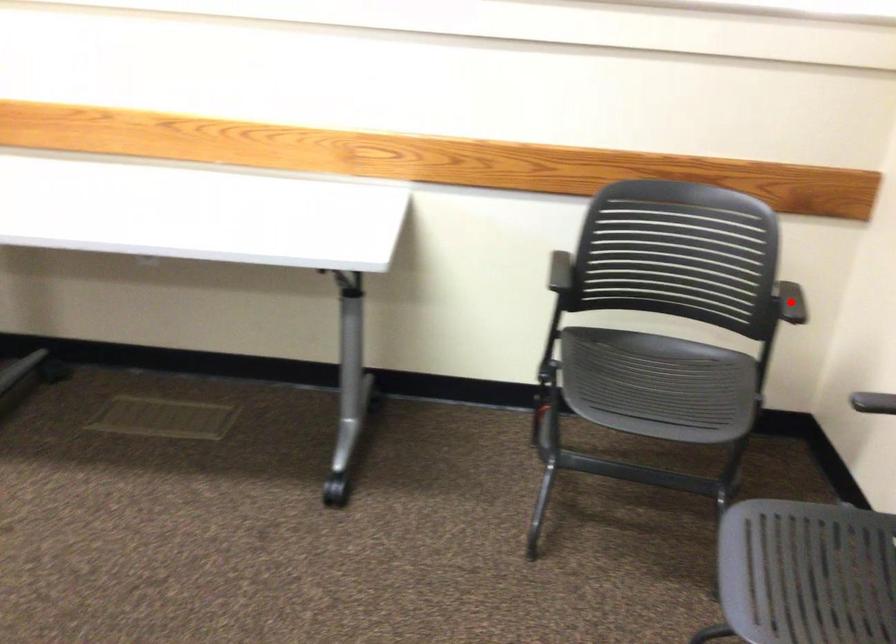
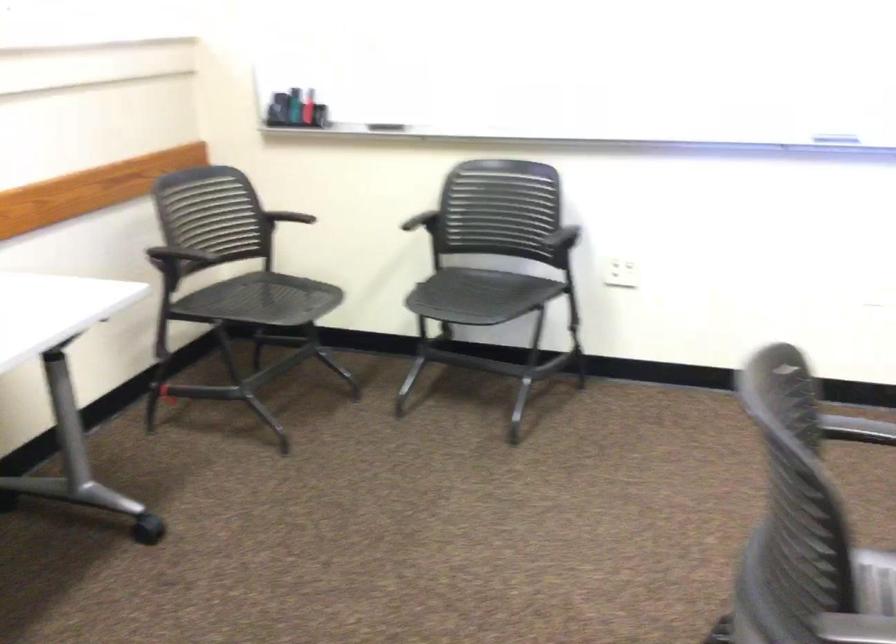
In the second image, find the point that corresponds to the highlighted location in the first image.

(308, 212)